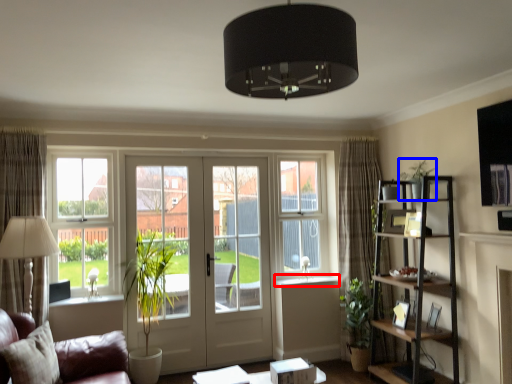
Question: Which object is further to the camera taking this photo, window sill (highlighted by a red box) or plant (highlighted by a blue box)?

Choices:
 (A) window sill
 (B) plant

Answer: (A)